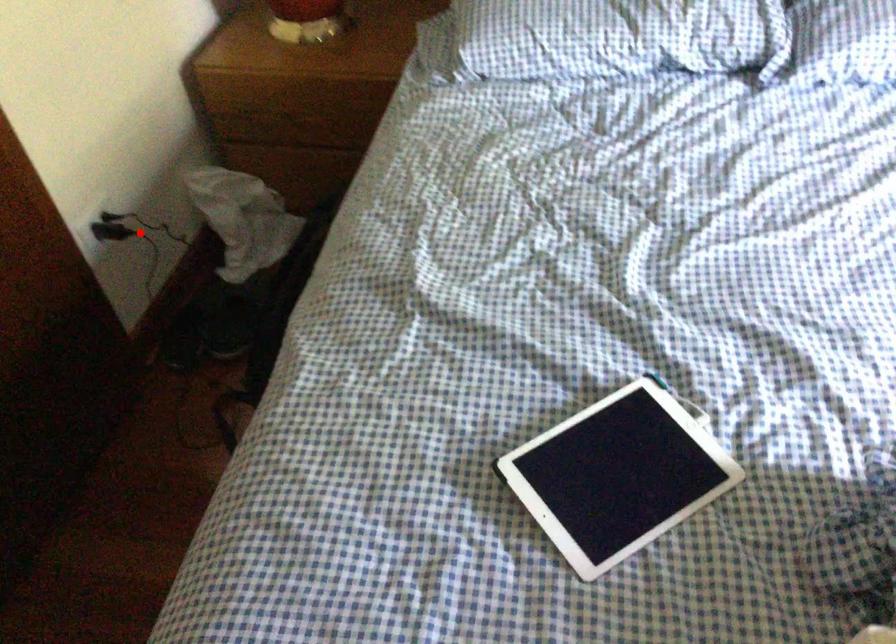
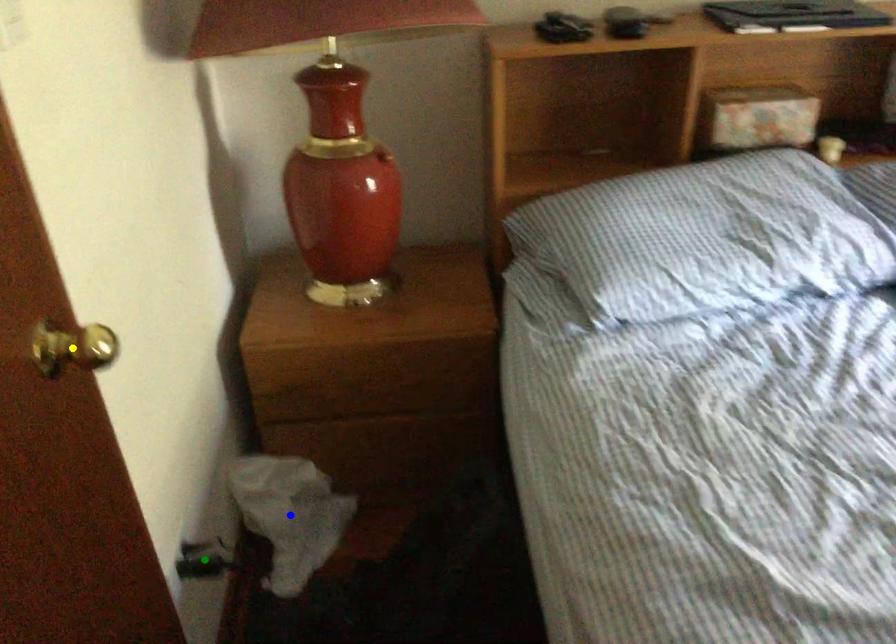
Question: I am providing you with two images of the same scene from different viewpoints. A red point is marked on the first image. You are given multiple points on the second image. Which spot in image 2 lines up with the point in image 1?

Choices:
 (A) yellow point
 (B) green point
 (C) blue point

Answer: (B)